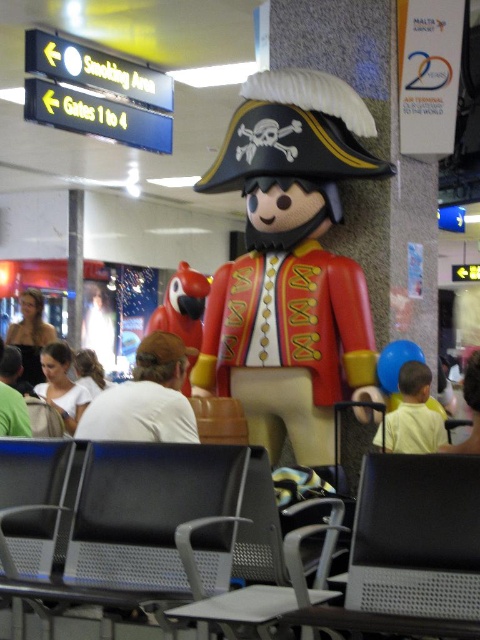
Question: Which point appears farthest from the camera in this image?

Choices:
 (A) (36, 305)
 (B) (106, 429)
 (C) (189, 292)
 (D) (103, 577)

Answer: (A)

Question: Is white cotton shirt at lower left thinner than light yellow shirt at center?

Choices:
 (A) yes
 (B) no

Answer: (B)

Question: Which point is farther to the camera?

Choices:
 (A) white matte shirt at center
 (B) light yellow shirt at center

Answer: (A)

Question: Is black metal chair at lower left thinner than white matte shirt at center?

Choices:
 (A) yes
 (B) no

Answer: (B)

Question: Among these objects, which one is nearest to the camera?

Choices:
 (A) light yellow shirt at center
 (B) white cotton shirt at lower left
 (C) white matte shirt at center
 (D) blonde hair at center

Answer: (D)

Question: Can you confirm if matte red parrot at center is smaller than white matte shirt at center?

Choices:
 (A) yes
 (B) no

Answer: (A)